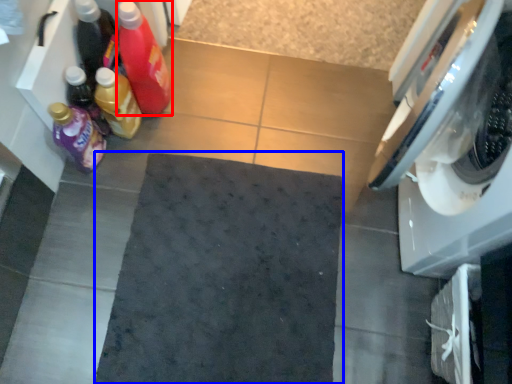
Question: Which of the following is the farthest to the observer, bottle (highlighted by a red box) or bath mat (highlighted by a blue box)?

Choices:
 (A) bottle
 (B) bath mat

Answer: (B)